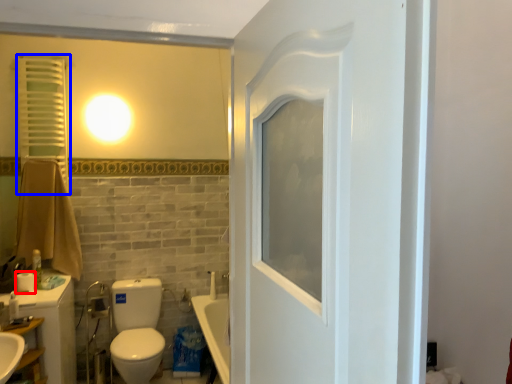
Question: Which point is closer to the camera, toilet paper (highlighted by a red box) or shutter (highlighted by a blue box)?

Choices:
 (A) toilet paper
 (B) shutter

Answer: (A)